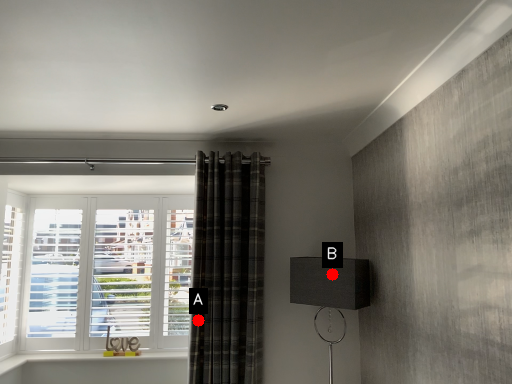
Question: Two points are circled on the image, labeled by A and B beside each circle. Which point is closer to the camera?

Choices:
 (A) A is closer
 (B) B is closer

Answer: (B)